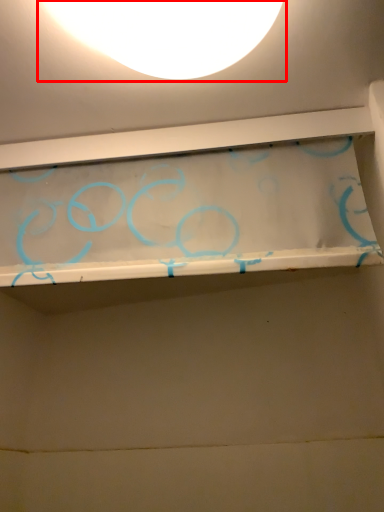
Question: From the image's perspective, where is lamp (annotated by the red box) located in relation to shelf in the image?

Choices:
 (A) above
 (B) below

Answer: (A)